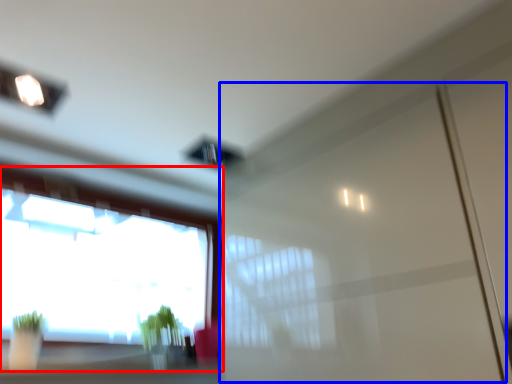
Question: Which of the following is the farthest to the observer, window (highlighted by a red box) or screen door (highlighted by a blue box)?

Choices:
 (A) window
 (B) screen door

Answer: (A)